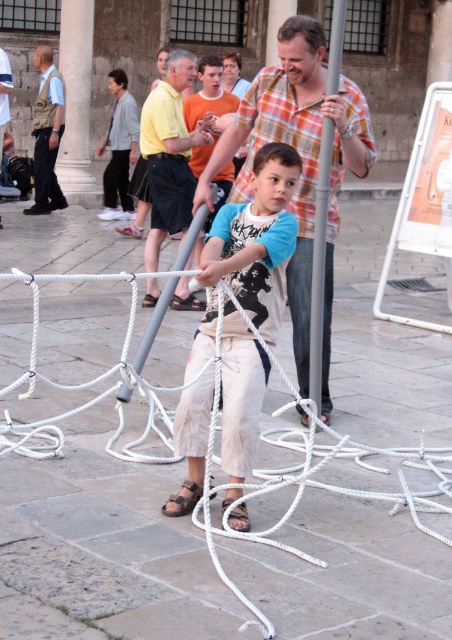
Question: Is light beige cotton pants at center thinner than khaki uniform at left?

Choices:
 (A) no
 (B) yes

Answer: (A)

Question: Which of the following is the closest to the observer?

Choices:
 (A) (287, 118)
 (B) (189, 60)
 (C) (34, 164)
 (D) (127, 428)

Answer: (A)

Question: Which point is farther from the camera taking this photo?

Choices:
 (A) (431, 468)
 (B) (47, 179)
 (C) (309, 33)

Answer: (B)

Question: Which is nearer to the plaid shirt at center?

Choices:
 (A) white rope at center
 (B) khaki uniform at left
 (C) yellow cotton shirt at center
 (D) light beige cotton pants at center

Answer: (D)

Question: Observing the image, what is the correct spatial positioning of white rope at center in reference to khaki uniform at left?

Choices:
 (A) above
 (B) below

Answer: (B)

Question: Is plaid shirt at center smaller than yellow cotton shirt at center?

Choices:
 (A) yes
 (B) no

Answer: (B)